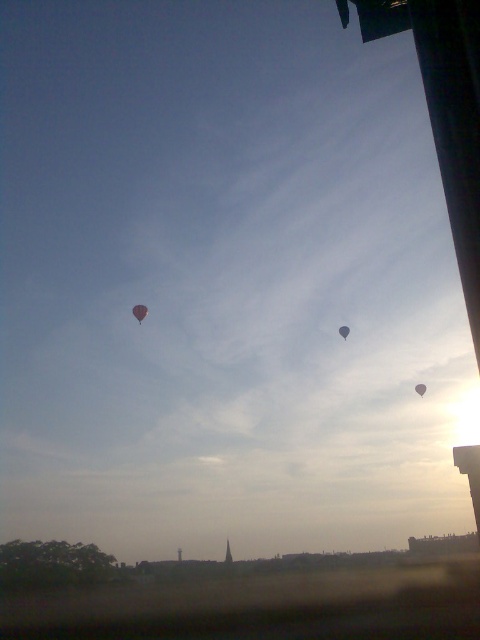
You are an observer looking at the sky scene. You notice two balloons, the gray matte balloon at upper center and the matte gray balloon at center. Which balloon appears wider?

The gray matte balloon at upper center appears wider since its width is larger than the matte gray balloon at center.

You are a photographer trying to capture both the matte pink balloon at upper center and the matte gray balloon at center in a single frame. Which balloon should you focus on first to ensure both are in the frame?

The matte pink balloon at upper center is higher than the matte gray balloon at center, so you should focus on the matte pink balloon at upper center first to ensure both are within the frame.